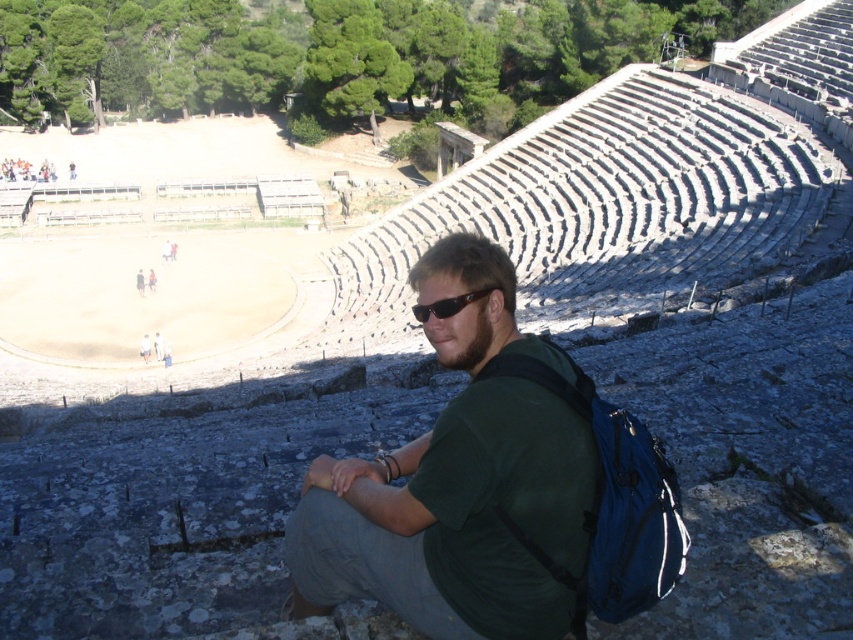
Can you confirm if green fabric shirt at center is thinner than blue fabric backpack at center?

No, green fabric shirt at center is not thinner than blue fabric backpack at center.

Does point (517, 465) come farther from viewer compared to point (498, 356)?

That is False.

Who is more distant from viewer, [492,616] or [589,417]?

The point [589,417] is more distant.

This screenshot has height=640, width=853. Find the location of `green fabric shirt at center`. green fabric shirt at center is located at coordinates (457, 483).

Can you confirm if green fabric shirt at center is bigger than black plastic sunglasses at center?

Yes, green fabric shirt at center is bigger than black plastic sunglasses at center.

Does green fabric shirt at center appear under black plastic sunglasses at center?

Yes, green fabric shirt at center is below black plastic sunglasses at center.

What do you see at coordinates (457, 483) in the screenshot? I see `green fabric shirt at center` at bounding box center [457, 483].

Locate an element on the screen. This screenshot has height=640, width=853. green fabric shirt at center is located at coordinates (457, 483).

Is point (643, 538) closer to camera compared to point (445, 307)?

Yes.

Can you confirm if blue fabric backpack at center is positioned above black plastic sunglasses at center?

No.

Who is more distant from viewer, (532,547) or (473,294)?

The point (473,294) is behind.

This screenshot has height=640, width=853. I want to click on blue fabric backpack at center, so click(610, 502).